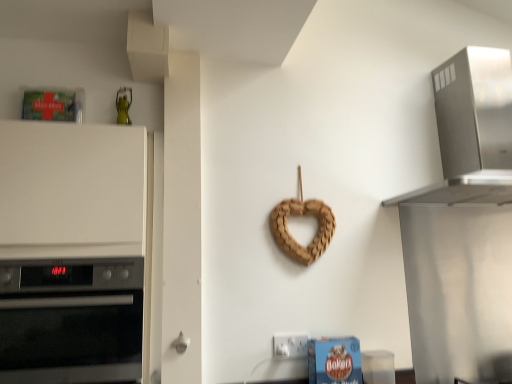
Question: Should I look upward or downward to see stainless steel range hood at upper right?

Choices:
 (A) down
 (B) up

Answer: (B)

Question: Does black glass oven at left have a smaller size compared to braided wood heart at center?

Choices:
 (A) no
 (B) yes

Answer: (A)

Question: Considering the relative sizes of black glass oven at left and braided wood heart at center in the image provided, is black glass oven at left shorter than braided wood heart at center?

Choices:
 (A) no
 (B) yes

Answer: (A)

Question: From a real-world perspective, is black glass oven at left on braided wood heart at center?

Choices:
 (A) yes
 (B) no

Answer: (B)

Question: Does black glass oven at left have a greater width compared to braided wood heart at center?

Choices:
 (A) yes
 (B) no

Answer: (A)

Question: Can we say black glass oven at left lies outside braided wood heart at center?

Choices:
 (A) yes
 (B) no

Answer: (A)

Question: Is black glass oven at left positioned with its back to braided wood heart at center?

Choices:
 (A) no
 (B) yes

Answer: (A)

Question: Is the position of black glass oven at left more distant than that of white plastic door handle at lower center?

Choices:
 (A) no
 (B) yes

Answer: (A)

Question: Does black glass oven at left turn towards white plastic door handle at lower center?

Choices:
 (A) yes
 (B) no

Answer: (B)

Question: From a real-world perspective, is black glass oven at left under white plastic door handle at lower center?

Choices:
 (A) yes
 (B) no

Answer: (B)

Question: Is black glass oven at left wider than white plastic door handle at lower center?

Choices:
 (A) no
 (B) yes

Answer: (B)

Question: Is black glass oven at left at the right side of white plastic door handle at lower center?

Choices:
 (A) no
 (B) yes

Answer: (A)

Question: Is white plastic door handle at lower center completely or partially inside black glass oven at left?

Choices:
 (A) no
 (B) yes

Answer: (A)

Question: Is white plastic electric outlet at lower center smaller than white matte oven at left?

Choices:
 (A) no
 (B) yes

Answer: (B)